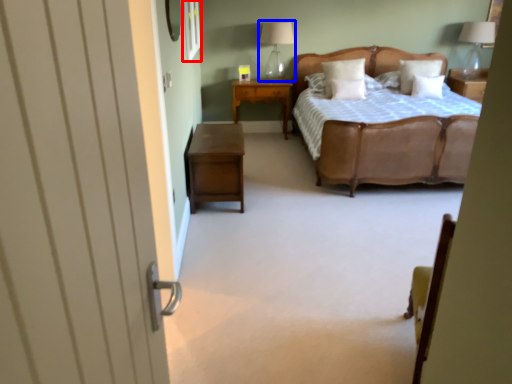
Question: Which object is closer to the camera taking this photo, window (highlighted by a red box) or table lamp (highlighted by a blue box)?

Choices:
 (A) window
 (B) table lamp

Answer: (A)